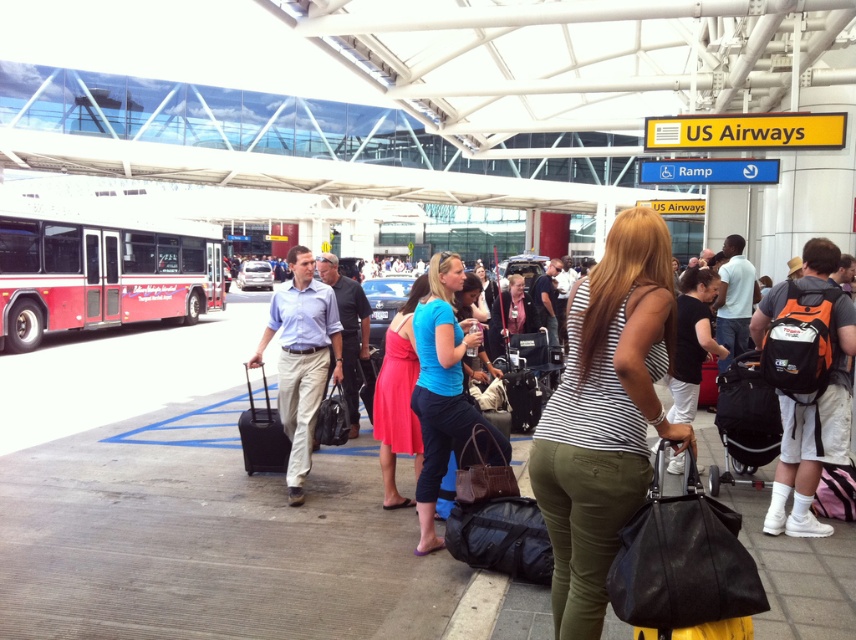
Question: Which point is closer to the camera?

Choices:
 (A) red metallic bus at left
 (B) matte pink dress at center
 (C) black hard suitcase at center
 (D) light blue shirt at center

Answer: (B)

Question: Is light beige cotton pants at center to the left of light blue shirt at center from the viewer's perspective?

Choices:
 (A) no
 (B) yes

Answer: (B)

Question: Is light beige cotton pants at center to the left of light blue shirt at center from the viewer's perspective?

Choices:
 (A) no
 (B) yes

Answer: (B)

Question: Observing the image, what is the correct spatial positioning of blue fabric dress at center in reference to black hard suitcase at center?

Choices:
 (A) left
 (B) right

Answer: (A)

Question: Which point is farther to the camera?

Choices:
 (A) (408, 330)
 (B) (645, 236)
 (C) (524, 417)

Answer: (C)

Question: Which object is the closest to the light blue shirt at center?

Choices:
 (A) red metallic bus at left
 (B) matte black suitcase at center
 (C) black hard suitcase at center

Answer: (B)